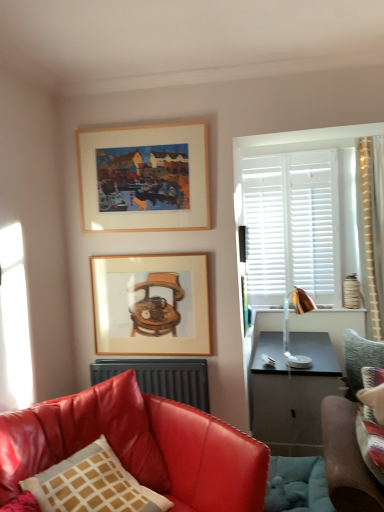
Question: Is dark gray metallic radiator at lower center to the right of wooden framed picture at center, the 2th picture frame viewed from the top, from the viewer's perspective?

Choices:
 (A) no
 (B) yes

Answer: (B)

Question: Can you confirm if dark gray metallic radiator at lower center is positioned to the left of wooden framed picture at center, acting as the 1th picture frame starting from the bottom?

Choices:
 (A) no
 (B) yes

Answer: (A)

Question: Considering the relative sizes of dark gray metallic radiator at lower center and wooden framed picture at center, acting as the 1th picture frame starting from the bottom, in the image provided, is dark gray metallic radiator at lower center bigger than wooden framed picture at center, acting as the 1th picture frame starting from the bottom,?

Choices:
 (A) yes
 (B) no

Answer: (A)

Question: From a real-world perspective, is dark gray metallic radiator at lower center located higher than wooden framed picture at center, acting as the 1th picture frame starting from the bottom?

Choices:
 (A) yes
 (B) no

Answer: (B)

Question: Can you confirm if dark gray metallic radiator at lower center is wider than wooden framed picture at center, the 2th picture frame viewed from the top?

Choices:
 (A) no
 (B) yes

Answer: (B)

Question: Is wooden framed picture at center, the 2th picture frame viewed from the top, inside the boundaries of shiny leather couch at lower left, the 2th studio couch from the back, or outside?

Choices:
 (A) inside
 (B) outside

Answer: (B)

Question: From the image's perspective, is wooden framed picture at center, the 2th picture frame viewed from the top, located above or below shiny leather couch at lower left, which is the second studio couch from right to left?

Choices:
 (A) above
 (B) below

Answer: (A)

Question: Considering the positions of wooden framed picture at center, acting as the 1th picture frame starting from the bottom, and shiny leather couch at lower left, which is the second studio couch from right to left, in the image, is wooden framed picture at center, acting as the 1th picture frame starting from the bottom, bigger or smaller than shiny leather couch at lower left, which is the second studio couch from right to left,?

Choices:
 (A) small
 (B) big

Answer: (A)

Question: From a real-world perspective, is wooden framed picture at center, the 2th picture frame viewed from the top, physically located above or below shiny leather couch at lower left, the 2th studio couch from the back?

Choices:
 (A) below
 (B) above

Answer: (B)

Question: From the image's perspective, is wooden framed picture at center, the 2th picture frame viewed from the top, located above or below dark gray metallic radiator at lower center?

Choices:
 (A) above
 (B) below

Answer: (A)

Question: Is wooden framed picture at center, the 2th picture frame viewed from the top, in front of or behind dark gray metallic radiator at lower center in the image?

Choices:
 (A) behind
 (B) front

Answer: (A)

Question: In terms of height, does wooden framed picture at center, acting as the 1th picture frame starting from the bottom, look taller or shorter compared to dark gray metallic radiator at lower center?

Choices:
 (A) tall
 (B) short

Answer: (A)

Question: Looking at their shapes, would you say wooden framed picture at center, the 2th picture frame viewed from the top, is wider or thinner than dark gray metallic radiator at lower center?

Choices:
 (A) wide
 (B) thin

Answer: (B)

Question: Is wooden frame at upper center, the 2th picture frame when ordered from bottom to top, in front of or behind shiny leather couch at lower left, placed as the first studio couch when sorted from front to back, in the image?

Choices:
 (A) behind
 (B) front

Answer: (A)

Question: From the image's perspective, relative to shiny leather couch at lower left, which is the second studio couch from right to left, is wooden frame at upper center, the 2th picture frame when ordered from bottom to top, above or below?

Choices:
 (A) above
 (B) below

Answer: (A)